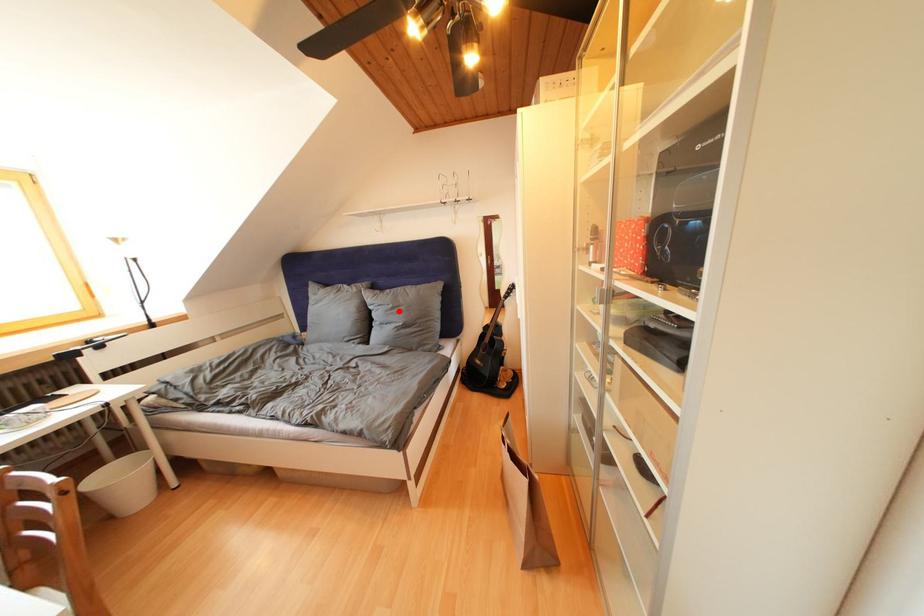
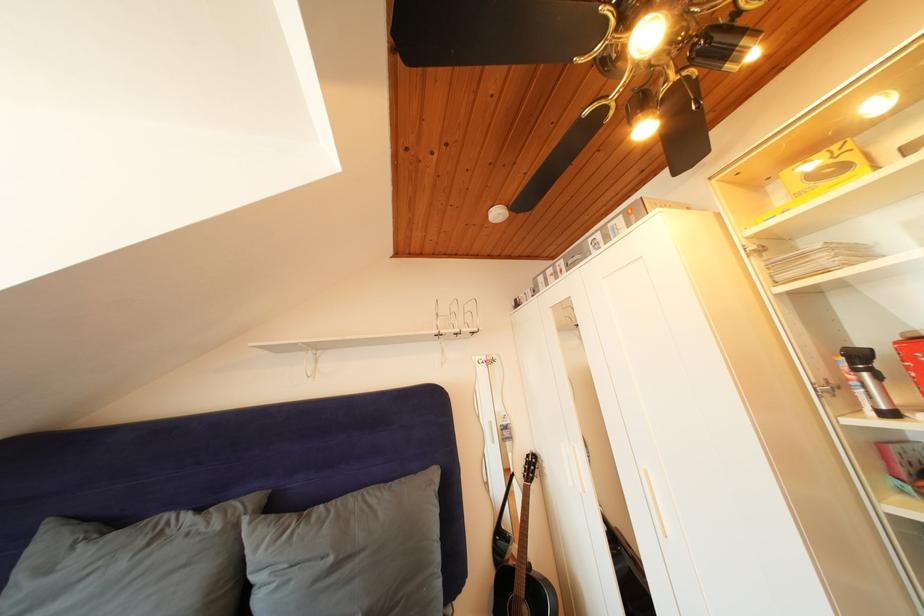
Question: I am providing you with two images of the same scene from different viewpoints. Image1 has a red point marked. In image2, the corresponding 3D location appears at what relative position? Reply with the corresponding letter.

Choices:
 (A) Closer
 (B) Farther

Answer: (B)